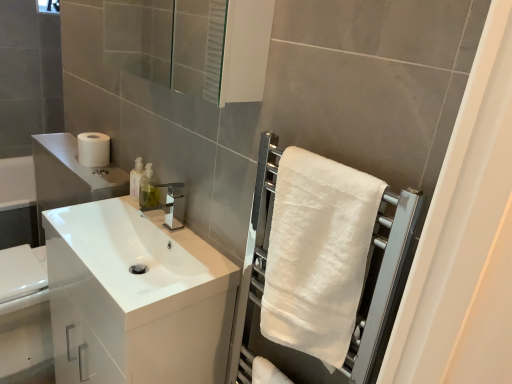
Question: From a real-world perspective, is white glossy cabinet at left above or below transparent glass mirror at upper center?

Choices:
 (A) below
 (B) above

Answer: (A)

Question: From the image's perspective, is white glossy cabinet at left above or below transparent glass mirror at upper center?

Choices:
 (A) above
 (B) below

Answer: (B)

Question: Estimate the real-world distances between objects in this image. Which object is farther from the translucent plastic soap dispenser at upper center?

Choices:
 (A) transparent glass mirror at upper center
 (B) translucent plastic soap dispenser at center
 (C) white soft towel at right
 (D) white glossy cabinet at left
 (E) white matte toilet paper at left

Answer: (A)

Question: Which object is the farthest from the white matte toilet paper at left?

Choices:
 (A) translucent plastic soap dispenser at upper center
 (B) translucent plastic soap dispenser at center
 (C) transparent glass mirror at upper center
 (D) white glossy cabinet at left
 (E) white soft towel at right

Answer: (E)